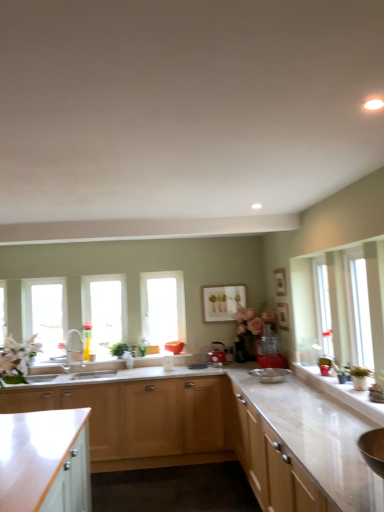
Find the location of a particular element. This screenshot has width=384, height=512. free point in front of metallic red kettle at center, which is the first appliance in left-to-right order is located at coordinates (215, 371).